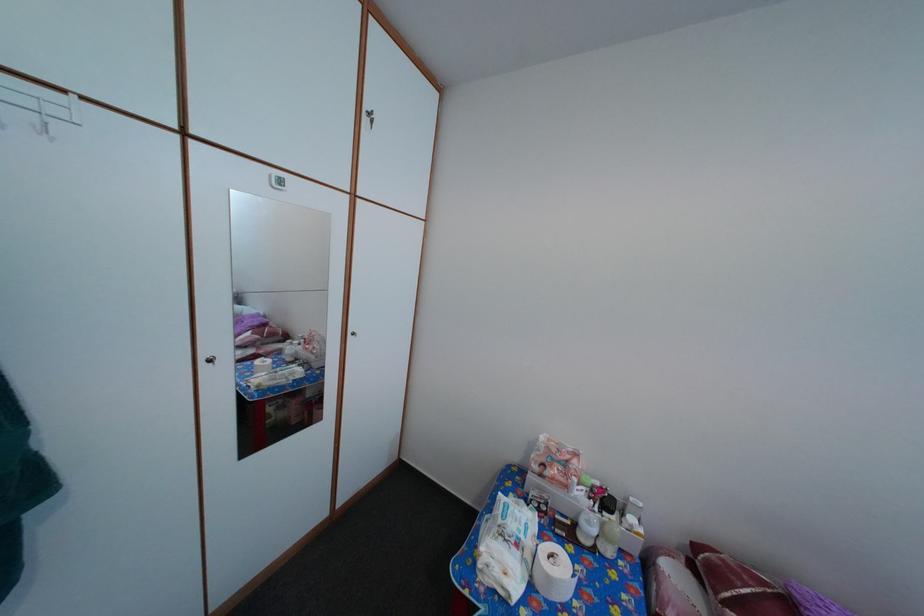
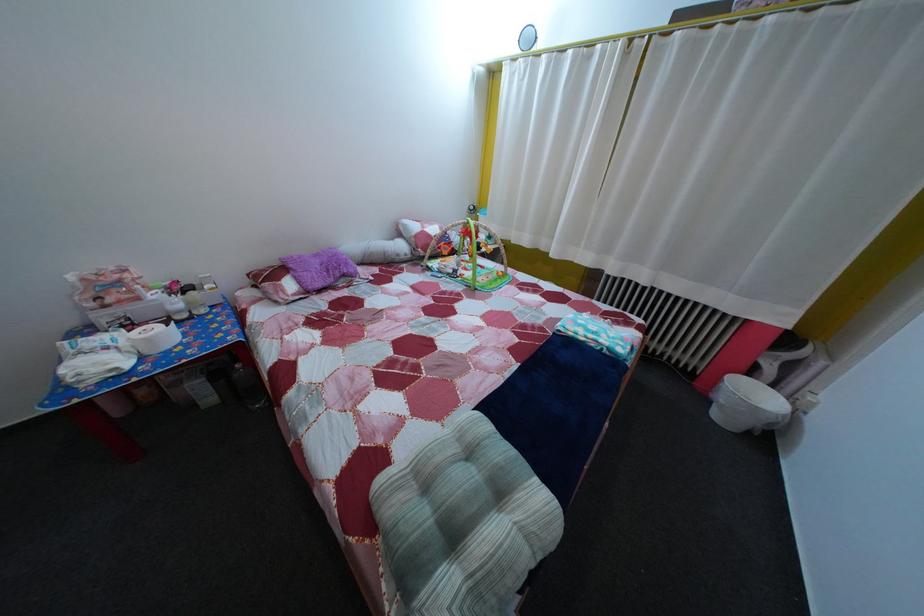
The first image is from the beginning of the video and the second image is from the end. How did the camera likely rotate when shooting the video?

The rotation direction of the camera is right-down.